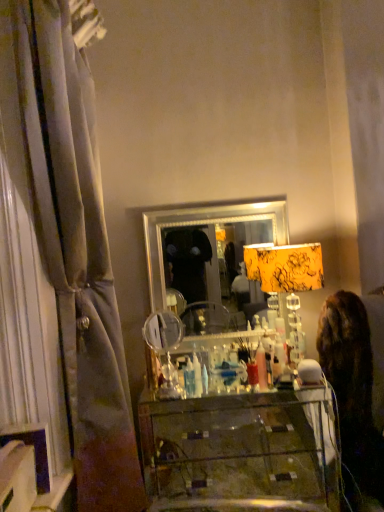
Question: Based on their positions, is transparent glass vanity at center located to the left or right of silver/metallic mirror at center?

Choices:
 (A) right
 (B) left

Answer: (A)

Question: Is transparent glass vanity at center taller or shorter than silver/metallic mirror at center?

Choices:
 (A) tall
 (B) short

Answer: (B)

Question: Which is nearer to the transparent glass vanity at center?

Choices:
 (A) silky gray curtain at left
 (B) dark brown fur at right
 (C) yellow floral fabric lampshade at center
 (D) silver/metallic mirror at center

Answer: (B)

Question: Based on their relative distances, which object is farther from the silver/metallic mirror at center?

Choices:
 (A) dark brown fur at right
 (B) yellow floral fabric lampshade at center
 (C) silky gray curtain at left
 (D) transparent glass vanity at center

Answer: (D)